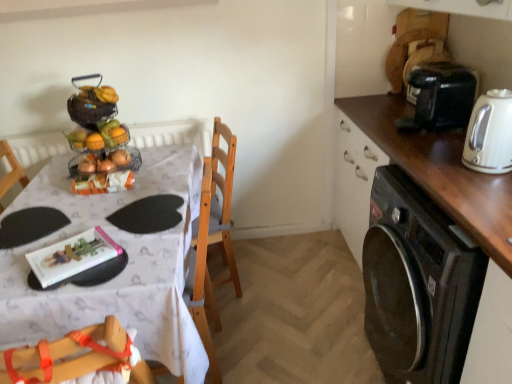
Question: From the image's perspective, is black plastic coffee machine at upper right on wooden chair at center, the second chair viewed from the front?

Choices:
 (A) no
 (B) yes

Answer: (B)

Question: Does black plastic coffee machine at upper right have a lesser width compared to wooden chair at center, the second chair viewed from the front?

Choices:
 (A) no
 (B) yes

Answer: (A)

Question: Is black plastic coffee machine at upper right not inside wooden chair at center, which ranks as the 1th chair in back-to-front order?

Choices:
 (A) no
 (B) yes

Answer: (B)

Question: From the image's perspective, is black plastic coffee machine at upper right under wooden chair at center, which ranks as the 1th chair in back-to-front order?

Choices:
 (A) no
 (B) yes

Answer: (A)

Question: Considering the relative sizes of black plastic coffee machine at upper right and wooden chair at center, the second chair viewed from the front, in the image provided, is black plastic coffee machine at upper right shorter than wooden chair at center, the second chair viewed from the front,?

Choices:
 (A) yes
 (B) no

Answer: (A)

Question: Is the position of black plastic coffee machine at upper right more distant than that of wooden chair at center, which ranks as the 1th chair in back-to-front order?

Choices:
 (A) yes
 (B) no

Answer: (B)

Question: Is wooden chair at lower left, which ranks as the first chair in front-to-back order, behind metallic wire fruit stand at upper left?

Choices:
 (A) no
 (B) yes

Answer: (A)

Question: From the image's perspective, is wooden chair at lower left, which ranks as the first chair in front-to-back order, located beneath metallic wire fruit stand at upper left?

Choices:
 (A) no
 (B) yes

Answer: (B)

Question: Does wooden chair at lower left, which ranks as the first chair in front-to-back order, turn towards metallic wire fruit stand at upper left?

Choices:
 (A) no
 (B) yes

Answer: (B)

Question: From a real-world perspective, is wooden chair at lower left, which ranks as the first chair in front-to-back order, under metallic wire fruit stand at upper left?

Choices:
 (A) no
 (B) yes

Answer: (B)

Question: Does wooden chair at lower left, arranged as the 2th chair when viewed from the back, have a lesser height compared to metallic wire fruit stand at upper left?

Choices:
 (A) no
 (B) yes

Answer: (B)

Question: Does wooden chair at lower left, which ranks as the first chair in front-to-back order, contain metallic wire fruit stand at upper left?

Choices:
 (A) yes
 (B) no

Answer: (B)

Question: Is shiny metallic fruit basket at upper left facing away from black matte paper plate at lower left?

Choices:
 (A) no
 (B) yes

Answer: (A)